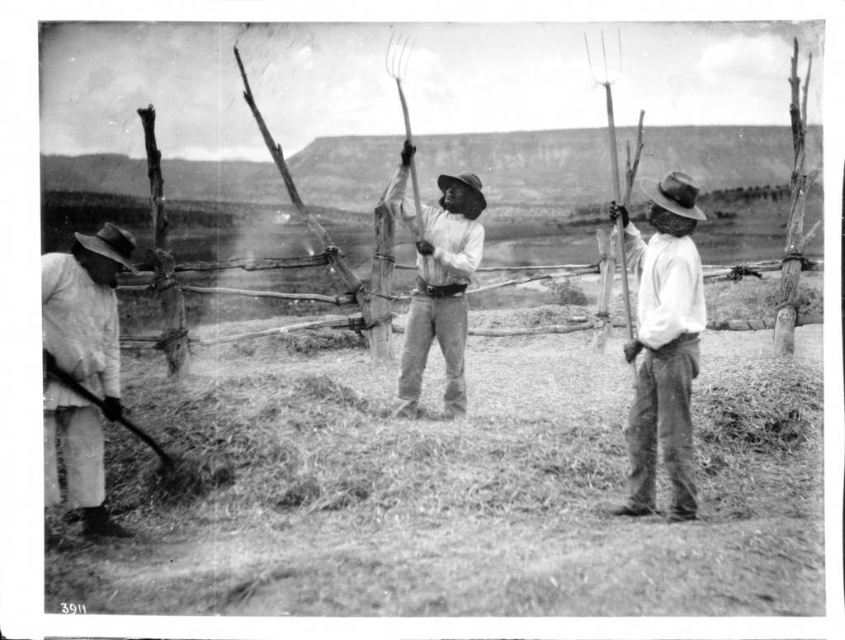
You are standing in the field and want to know how far the point at coordinates (91, 492) is from you. Can you determine the distance?

The distance of point (91, 492) from camera is 19.94 feet. So the point is 19.94 feet away from you.

You are a tailor who needs to know the size of the shirts to make a new one. Which shirt has a larger width between the smooth white shirt at right and the white cotton shirt at left?

The smooth white shirt at right has a larger width than the white cotton shirt at left according to the description.

You are a photographer trying to capture a closeup of the smooth wood pitchfork at center without including the smooth white shirt at right in the frame. Based on their positions, can you position yourself in a way to achieve this?

A: The smooth white shirt at right is positioned on the right side of the smooth wood pitchfork at center. To avoid including the smooth white shirt at right, position yourself to the right of the smooth wood pitchfork at center so that the shirt is out of frame.